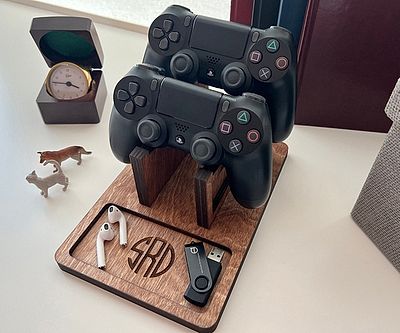
I want to click on white table, so click(x=316, y=193).